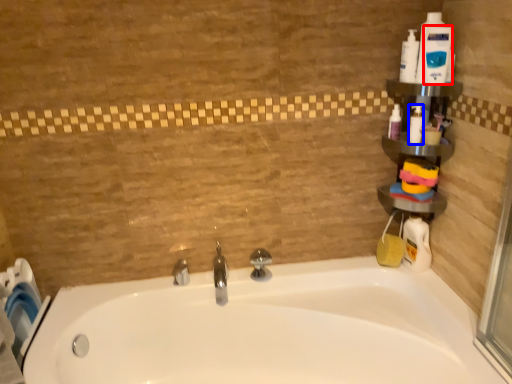
Question: Which of the following is the closest to the observer, cleaning product (highlighted by a red box) or cleaning product (highlighted by a blue box)?

Choices:
 (A) cleaning product
 (B) cleaning product

Answer: (A)